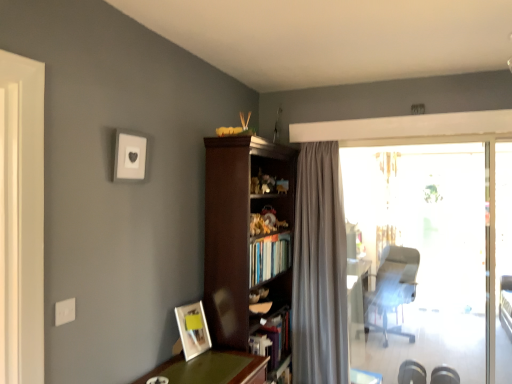
Question: From the image's perspective, does satin gray curtain at center appear lower than matte wooden picture frame at lower left, the 2th picture frame positioned from the top?

Choices:
 (A) yes
 (B) no

Answer: (B)

Question: From a real-world perspective, is satin gray curtain at center on matte wooden picture frame at lower left, the 2th picture frame positioned from the top?

Choices:
 (A) yes
 (B) no

Answer: (A)

Question: Considering the relative sizes of satin gray curtain at center and matte wooden picture frame at lower left, the 2th picture frame viewed from the left, in the image provided, is satin gray curtain at center bigger than matte wooden picture frame at lower left, the 2th picture frame viewed from the left,?

Choices:
 (A) no
 (B) yes

Answer: (B)

Question: Is satin gray curtain at center directly adjacent to matte wooden picture frame at lower left, the second picture frame viewed from the front?

Choices:
 (A) yes
 (B) no

Answer: (B)

Question: From a real-world perspective, is satin gray curtain at center beneath matte wooden picture frame at lower left, the second picture frame viewed from the front?

Choices:
 (A) yes
 (B) no

Answer: (B)

Question: Is dark wood bookcase at center in front of or behind matte wooden picture frame at lower left, the 2th picture frame viewed from the left, in the image?

Choices:
 (A) behind
 (B) front

Answer: (A)

Question: From the image's perspective, is dark wood bookcase at center above or below matte wooden picture frame at lower left, which ranks as the 1th picture frame in right-to-left order?

Choices:
 (A) above
 (B) below

Answer: (A)

Question: From a real-world perspective, is dark wood bookcase at center positioned above or below matte wooden picture frame at lower left, which is the 1th picture frame in back-to-front order?

Choices:
 (A) below
 (B) above

Answer: (B)

Question: Considering the positions of dark wood bookcase at center and matte wooden picture frame at lower left, which ranks as the 1th picture frame in right-to-left order, in the image, is dark wood bookcase at center wider or thinner than matte wooden picture frame at lower left, which ranks as the 1th picture frame in right-to-left order,?

Choices:
 (A) thin
 (B) wide

Answer: (B)

Question: Is point (339, 322) closer or farther from the camera than point (468, 365)?

Choices:
 (A) closer
 (B) farther

Answer: (A)

Question: In terms of width, does satin gray curtain at center look wider or thinner when compared to transparent glass door at right?

Choices:
 (A) thin
 (B) wide

Answer: (B)

Question: Is satin gray curtain at center in front of or behind transparent glass door at right in the image?

Choices:
 (A) behind
 (B) front

Answer: (B)

Question: Visually, is satin gray curtain at center positioned to the left or to the right of transparent glass door at right?

Choices:
 (A) left
 (B) right

Answer: (A)

Question: Is metallic silver chair at right to the left or to the right of transparent glass door at right in the image?

Choices:
 (A) left
 (B) right

Answer: (B)

Question: From a real-world perspective, is metallic silver chair at right physically located above or below transparent glass door at right?

Choices:
 (A) above
 (B) below

Answer: (B)